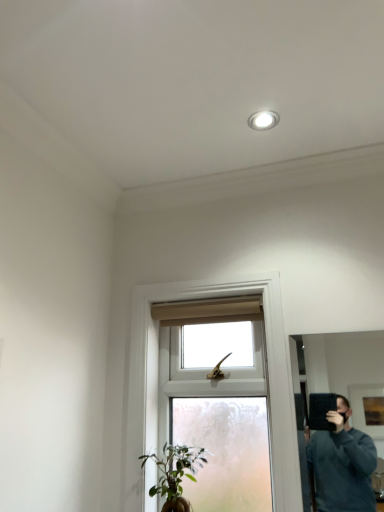
Question: Is white glossy recessed light at upper center far away from clear glass window at center?

Choices:
 (A) no
 (B) yes

Answer: (A)

Question: Considering the relative sizes of white glossy recessed light at upper center and clear glass window at center in the image provided, is white glossy recessed light at upper center smaller than clear glass window at center?

Choices:
 (A) no
 (B) yes

Answer: (B)

Question: Would you say clear glass window at center is part of white glossy recessed light at upper center's contents?

Choices:
 (A) no
 (B) yes

Answer: (A)

Question: Is white glossy recessed light at upper center directly adjacent to clear glass window at center?

Choices:
 (A) no
 (B) yes

Answer: (A)

Question: From a real-world perspective, is white glossy recessed light at upper center positioned under clear glass window at center based on gravity?

Choices:
 (A) no
 (B) yes

Answer: (A)

Question: Does point (258, 125) appear closer or farther from the camera than point (327, 353)?

Choices:
 (A) closer
 (B) farther

Answer: (A)

Question: Looking at the image, does white glossy recessed light at upper center seem bigger or smaller compared to black matte mirror at right?

Choices:
 (A) big
 (B) small

Answer: (B)

Question: From the image's perspective, is white glossy recessed light at upper center positioned above or below black matte mirror at right?

Choices:
 (A) below
 (B) above

Answer: (B)

Question: From a real-world perspective, relative to black matte mirror at right, is white glossy recessed light at upper center vertically above or below?

Choices:
 (A) above
 (B) below

Answer: (A)

Question: In terms of height, does green matte plant at lower center look taller or shorter compared to clear glass window at center?

Choices:
 (A) short
 (B) tall

Answer: (A)

Question: In terms of width, does green matte plant at lower center look wider or thinner when compared to clear glass window at center?

Choices:
 (A) thin
 (B) wide

Answer: (A)

Question: Would you say green matte plant at lower center is to the left or to the right of clear glass window at center in the picture?

Choices:
 (A) right
 (B) left

Answer: (B)

Question: Does point (173, 458) appear closer or farther from the camera than point (142, 499)?

Choices:
 (A) closer
 (B) farther

Answer: (B)

Question: In terms of height, does green matte plant at lower center look taller or shorter compared to white glossy recessed light at upper center?

Choices:
 (A) short
 (B) tall

Answer: (B)

Question: Is green matte plant at lower center wider or thinner than white glossy recessed light at upper center?

Choices:
 (A) wide
 (B) thin

Answer: (A)